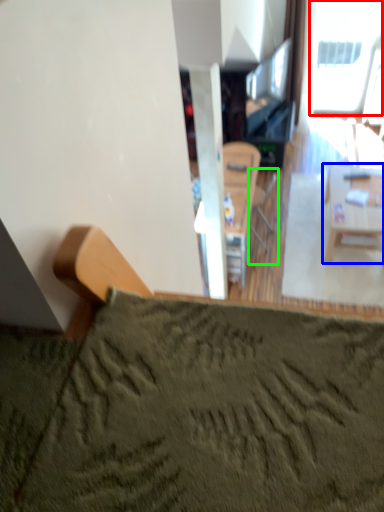
Question: Considering the real-world distances, which object is closest to window (highlighted by a red box)? table (highlighted by a blue box) or armchair (highlighted by a green box).

Choices:
 (A) table
 (B) armchair

Answer: (B)